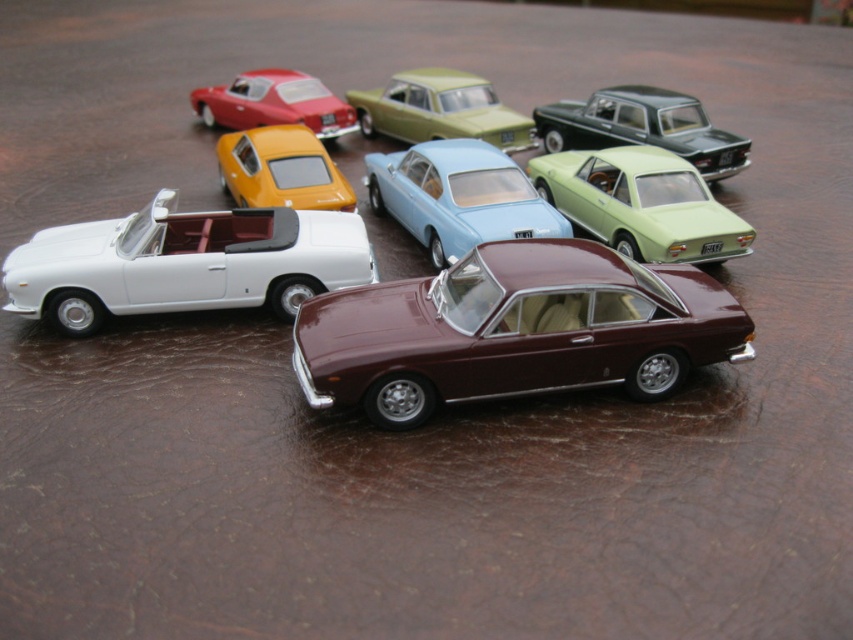
Is satin burgundy car at center bigger than white matte convertible at left?

Indeed, satin burgundy car at center has a larger size compared to white matte convertible at left.

Who is positioned more to the left, satin burgundy car at center or white matte convertible at left?

white matte convertible at left is more to the left.

This screenshot has height=640, width=853. Identify the location of satin burgundy car at center. (514, 330).

Is metallic green station wagon at upper center bigger than matte red car at upper left?

Correct, metallic green station wagon at upper center is larger in size than matte red car at upper left.

Does metallic green station wagon at upper center have a lesser height compared to matte red car at upper left?

No, metallic green station wagon at upper center is not shorter than matte red car at upper left.

Is point (558, 100) farther from camera compared to point (308, 122)?

Yes.

Find the location of a particular element. This screenshot has width=853, height=640. metallic green station wagon at upper center is located at coordinates (642, 128).

Who is taller, light green plastic car at center-right or matte red car at upper left?

With more height is light green plastic car at center-right.

Is point (566, 184) behind point (277, 97)?

No, it is not.

Where is `light green plastic car at center-right`? light green plastic car at center-right is located at coordinates (641, 204).